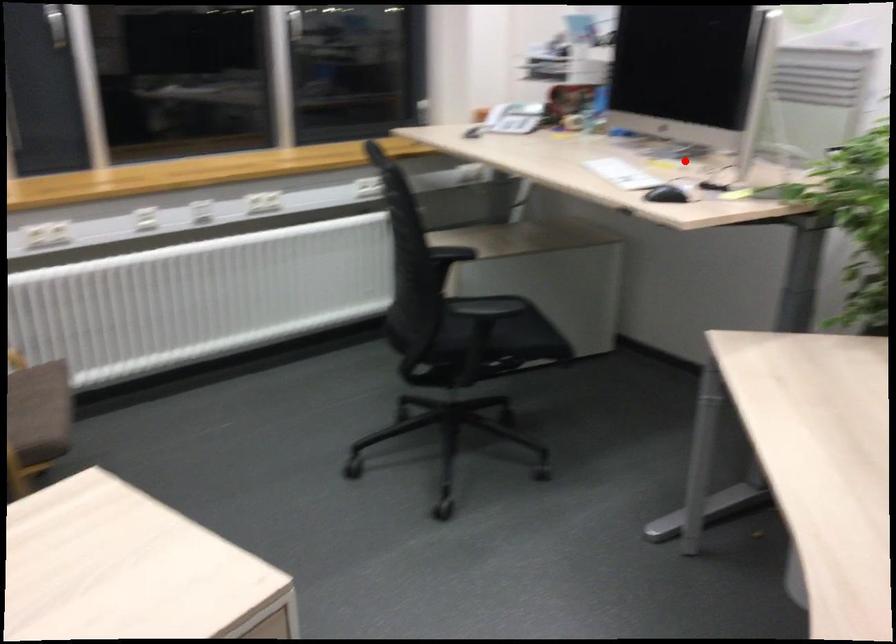
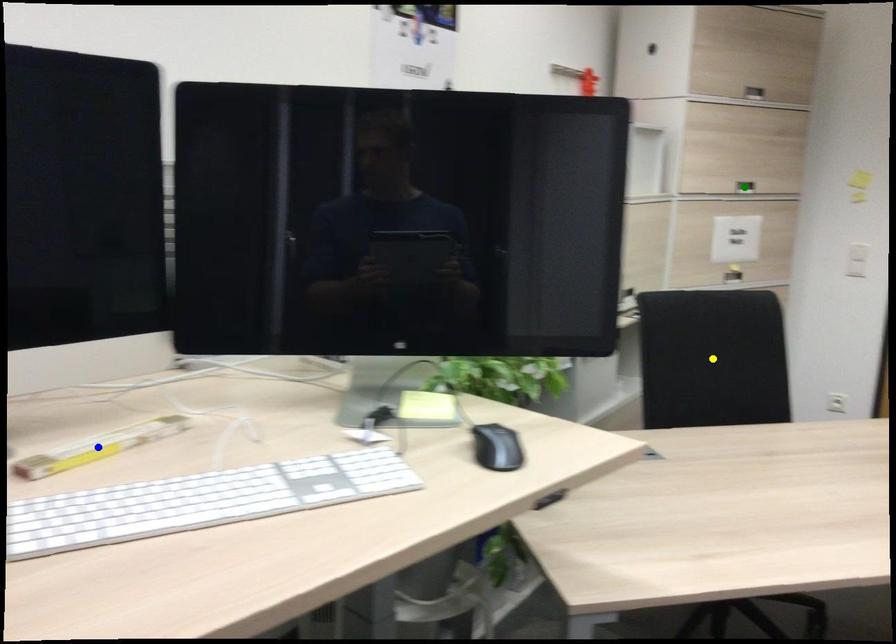
Question: I am providing you with two images of the same scene from different viewpoints. A red point is marked on the first image. You are given multiple points on the second image. Which spot in image 2 lines up with the point in image 1?

Choices:
 (A) yellow point
 (B) green point
 (C) blue point

Answer: (C)